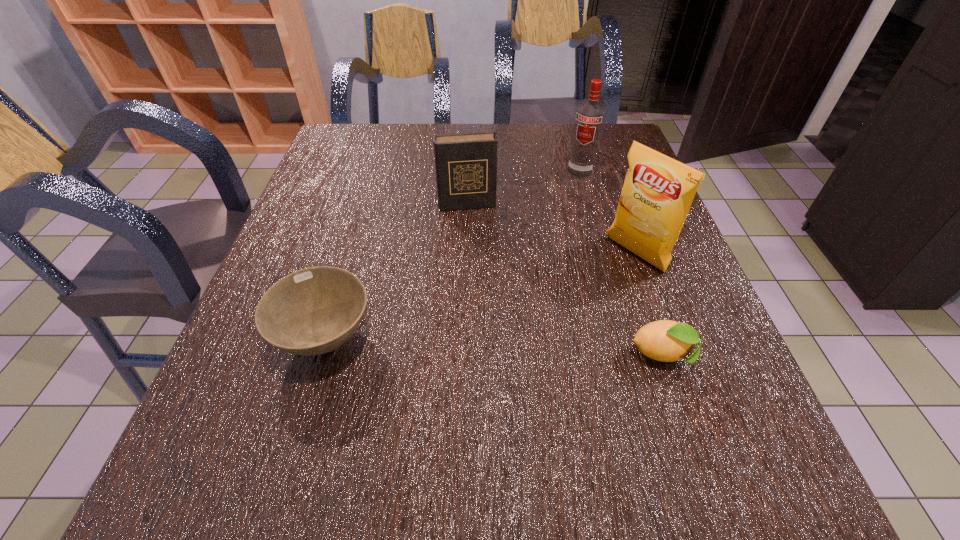
At what (x,y) coordinates should I click in order to perform the action: click on free area in between the farthest object and the shortest object. Please return your answer as a coordinate pair (x, y). Looking at the image, I should click on click(x=621, y=263).

Locate an element on the screen. This screenshot has width=960, height=540. vacant space in between the shortest object and the bowl is located at coordinates (494, 347).

The image size is (960, 540). In order to click on empty location between the leftmost object and the crisp (potato chip) in this screenshot , I will do `click(480, 296)`.

The image size is (960, 540). What are the coordinates of `unoccupied area between the farthest object and the diary` in the screenshot? It's located at (523, 187).

You are a GUI agent. You are given a task and a screenshot of the screen. Output one action in this format:
    pyautogui.click(x=<x>, y=<y>)
    Task: Click on the free space that is in between the shortest object and the second object from left to right
    The width and height of the screenshot is (960, 540).
    Given the screenshot: What is the action you would take?
    pyautogui.click(x=565, y=280)

You are a GUI agent. You are given a task and a screenshot of the screen. Output one action in this format:
    pyautogui.click(x=<x>, y=<y>)
    Task: Click on the vacant region between the shortest object and the vodka
    Image resolution: width=960 pixels, height=540 pixels.
    Given the screenshot: What is the action you would take?
    pyautogui.click(x=621, y=263)

I want to click on free space between the third shortest object and the farthest object, so click(523, 187).

Where is `free spot between the farthest object and the fourth nearest object`? The width and height of the screenshot is (960, 540). free spot between the farthest object and the fourth nearest object is located at coordinates (523, 187).

At what (x,y) coordinates should I click in order to perform the action: click on vacant area that lies between the shortest object and the fourth tallest object. Please return your answer as a coordinate pair (x, y). Looking at the image, I should click on (494, 347).

Where is `free space between the lemon and the crisp (potato chip)`? The width and height of the screenshot is (960, 540). free space between the lemon and the crisp (potato chip) is located at coordinates click(649, 305).